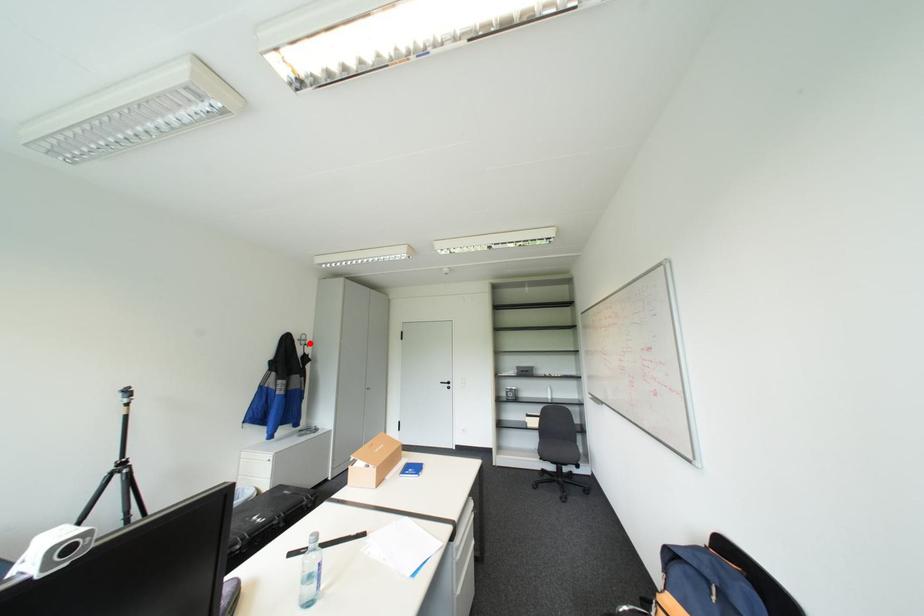
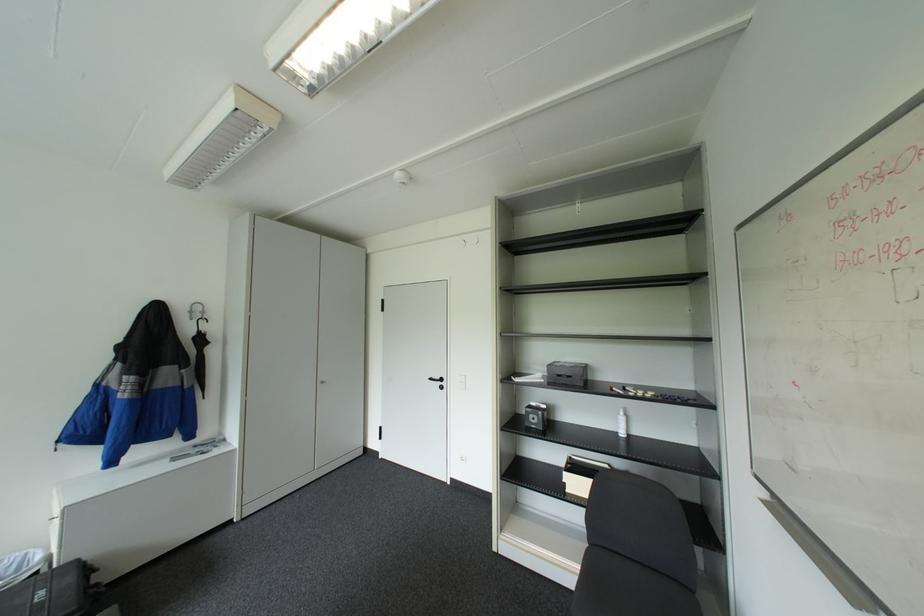
Locate, in the second image, the point that corresponds to the highlighted location in the first image.

(200, 318)